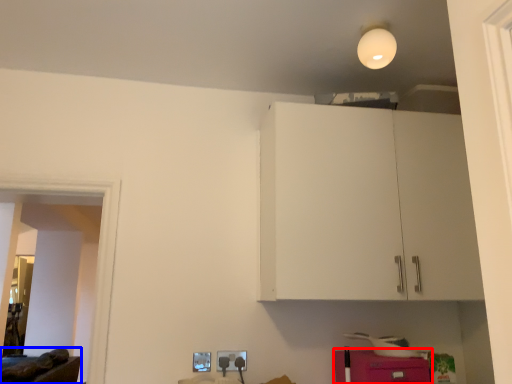
Question: Which object is further to the camera taking this photo, cabinetry (highlighted by a red box) or furniture (highlighted by a blue box)?

Choices:
 (A) cabinetry
 (B) furniture

Answer: (B)